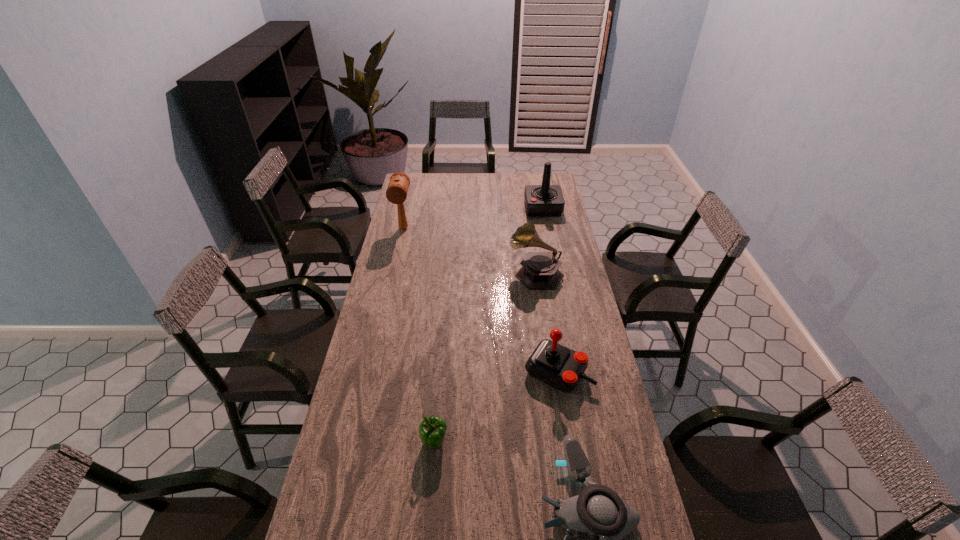
At what (x,y) coordinates should I click in order to perform the action: click on vacant space located on the front-facing side of the farther joystick. Please return your answer as a coordinate pair (x, y). This screenshot has width=960, height=540. Looking at the image, I should click on (481, 208).

Where is `vacant position located on the front-facing side of the farther joystick`? This screenshot has width=960, height=540. vacant position located on the front-facing side of the farther joystick is located at coordinates (497, 208).

Identify the location of free spot located 0.300m on the front-facing side of the farther joystick. (x=469, y=208).

You are a GUI agent. You are given a task and a screenshot of the screen. Output one action in this format:
    pyautogui.click(x=<x>, y=<y>)
    Task: Click on the free space located on the horn direction of the phonograph record
    The height and width of the screenshot is (540, 960).
    Given the screenshot: What is the action you would take?
    pyautogui.click(x=468, y=273)

At what (x,y) coordinates should I click in order to perform the action: click on vacant space situated on the horn direction of the phonograph record. Please return your answer as a coordinate pair (x, y). The height and width of the screenshot is (540, 960). Looking at the image, I should click on (428, 273).

This screenshot has height=540, width=960. In order to click on vacant space located 0.140m on the horn direction of the phonograph record in this screenshot , I will do `click(477, 273)`.

In order to click on free space located 0.180m on the left of the shorter joystick in this screenshot , I will do `click(473, 372)`.

The image size is (960, 540). I want to click on free space located 0.090m on the left of the second object from left to right, so click(x=392, y=443).

You are a GUI agent. You are given a task and a screenshot of the screen. Output one action in this format:
    pyautogui.click(x=<x>, y=<y>)
    Task: Click on the object that is at the left edge
    The width and height of the screenshot is (960, 540).
    Given the screenshot: What is the action you would take?
    pyautogui.click(x=396, y=193)

The width and height of the screenshot is (960, 540). In order to click on phonograph record present at the right edge in this screenshot , I will do `click(539, 271)`.